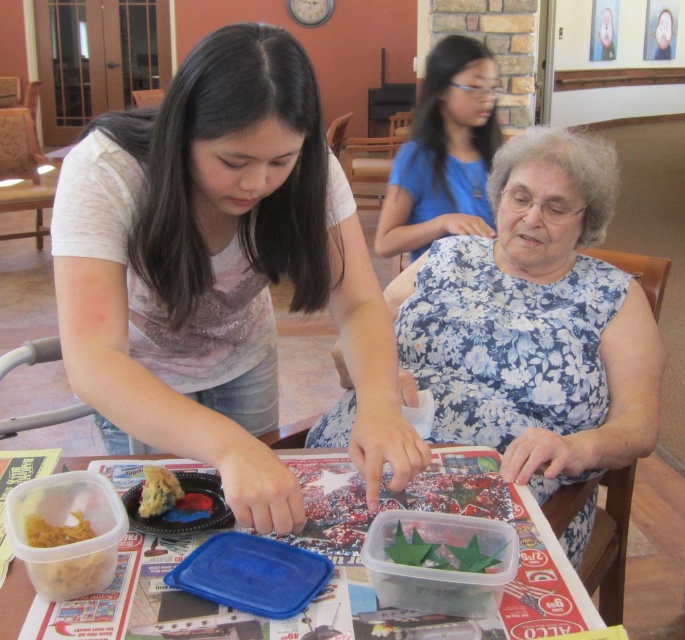
Who is taller, clear plastic table at center or yellowish matte food at lower left?

clear plastic table at center is taller.

This screenshot has height=640, width=685. What do you see at coordinates (199, 605) in the screenshot? I see `clear plastic table at center` at bounding box center [199, 605].

Find the location of a particular element. clear plastic table at center is located at coordinates (199, 605).

This screenshot has width=685, height=640. Identify the location of clear plastic table at center. 199,605.

Does point (71, 579) come closer to viewer compared to point (147, 476)?

That is True.

Who is more forward, (x=62, y=556) or (x=149, y=465)?

Positioned in front is point (x=62, y=556).

The height and width of the screenshot is (640, 685). I want to click on yellowish matte food at lower left, so click(66, 557).

Between blue fabric at upper center and yellowish matte food at lower left, which one has more height?

Standing taller between the two is blue fabric at upper center.

Can you confirm if blue fabric at upper center is positioned to the left of yellowish matte food at lower left?

No, blue fabric at upper center is not to the left of yellowish matte food at lower left.

What do you see at coordinates (445, 152) in the screenshot? The width and height of the screenshot is (685, 640). I see `blue fabric at upper center` at bounding box center [445, 152].

Find the location of a particular element. The width and height of the screenshot is (685, 640). blue fabric at upper center is located at coordinates (445, 152).